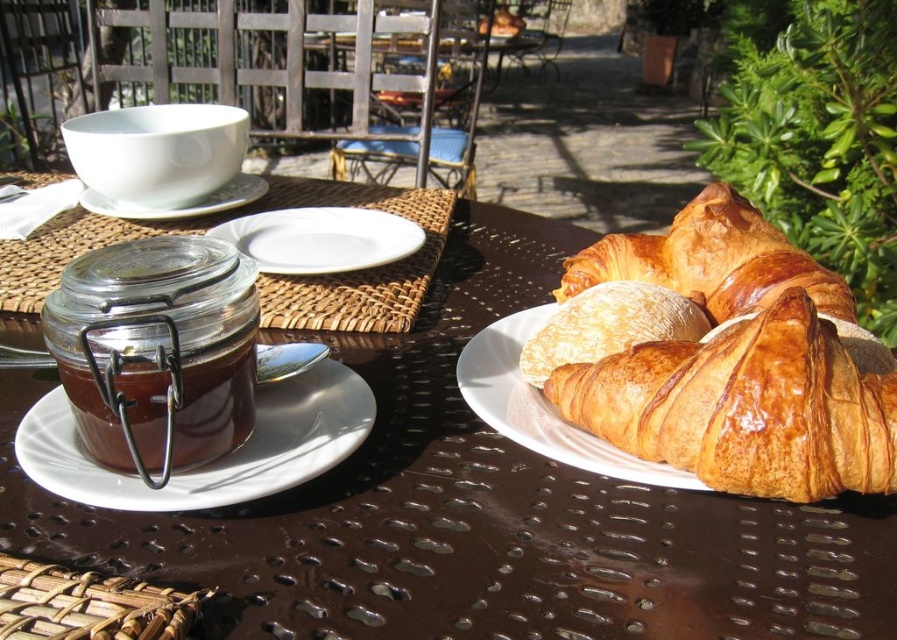
Question: Can you confirm if white ceramic plate at right is positioned below white ceramic plate at center?

Choices:
 (A) no
 (B) yes

Answer: (B)

Question: Among these points, which one is farthest from the camera?

Choices:
 (A) (x=306, y=378)
 (B) (x=238, y=243)
 (C) (x=779, y=294)

Answer: (B)

Question: Estimate the real-world distances between objects in this image. Which object is farther from the golden brown flaky croissant at center?

Choices:
 (A) white ceramic saucer at upper left
 (B) matte white saucer at center-left
 (C) white ceramic plate at right
 (D) translucent glass jar at left

Answer: (A)

Question: Which object is the farthest from the translucent glass jar at left?

Choices:
 (A) matte white saucer at center-left
 (B) golden brown flaky croissant at center
 (C) brown textured table at center
 (D) golden brown flaky croissant at right

Answer: (D)

Question: Does matte white saucer at center-left appear on the right side of white ceramic plate at center?

Choices:
 (A) no
 (B) yes

Answer: (A)

Question: Does golden brown flaky croissant at right appear on the right side of golden brown flaky croissant at center?

Choices:
 (A) yes
 (B) no

Answer: (A)